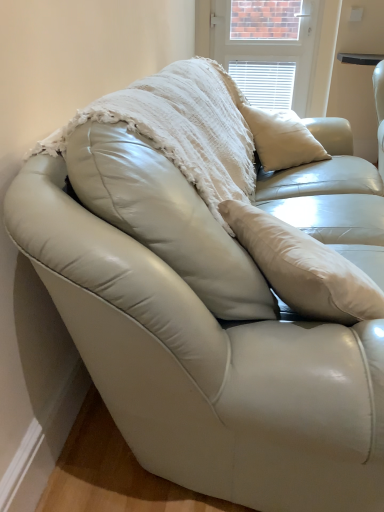
Question: Looking at the image, does white textured blanket at center seem bigger or smaller compared to white textured blinds at upper center?

Choices:
 (A) small
 (B) big

Answer: (B)

Question: Considering the positions of point (208, 154) and point (297, 55), is point (208, 154) closer or farther from the camera than point (297, 55)?

Choices:
 (A) closer
 (B) farther

Answer: (A)

Question: Considering the real-world distances, which object is closest to the white leather table at upper right?

Choices:
 (A) white textured blinds at upper center
 (B) white textured blanket at center

Answer: (A)

Question: Which is nearer to the white textured blinds at upper center?

Choices:
 (A) white textured blanket at center
 (B) white leather table at upper right

Answer: (B)